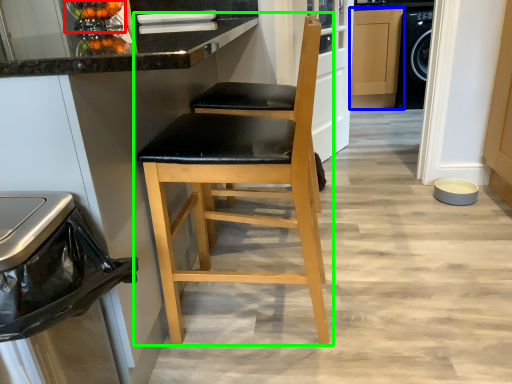
Question: Estimate the real-world distances between objects in this image. Which object is farther from appliance (highlighted by a red box), cabinetry (highlighted by a blue box) or chair (highlighted by a green box)?

Choices:
 (A) cabinetry
 (B) chair

Answer: (A)